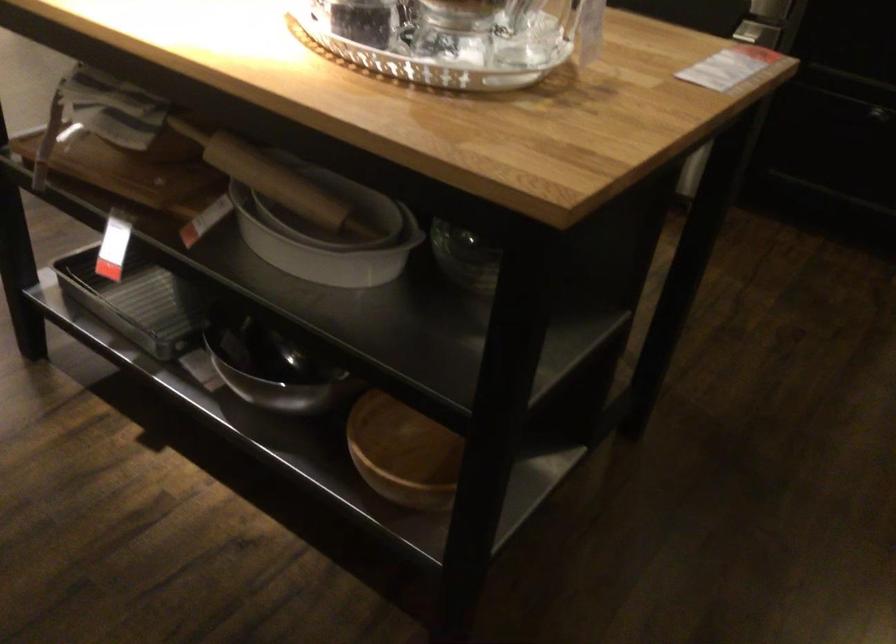
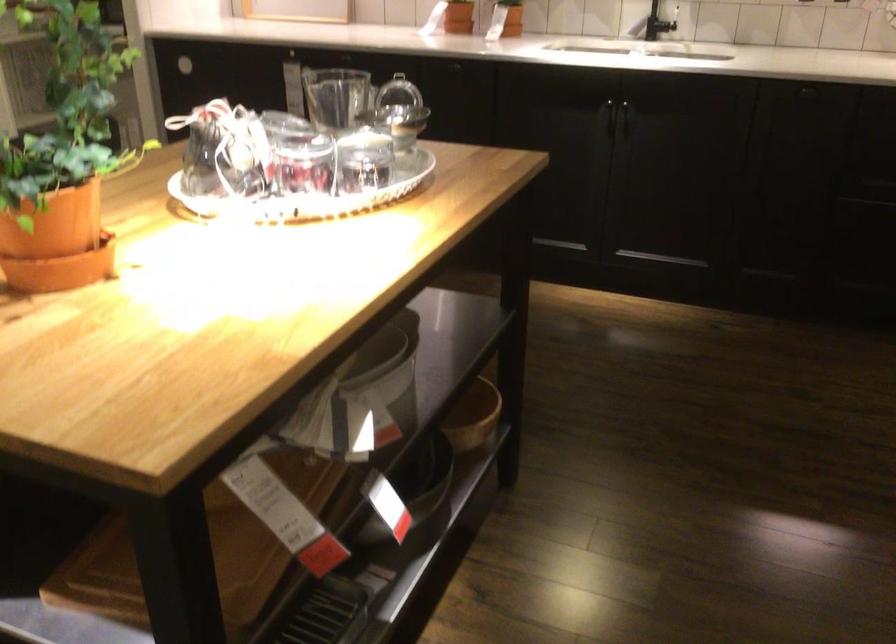
In the second image, find the point that corresponds to point (424, 533) in the first image.

(472, 415)